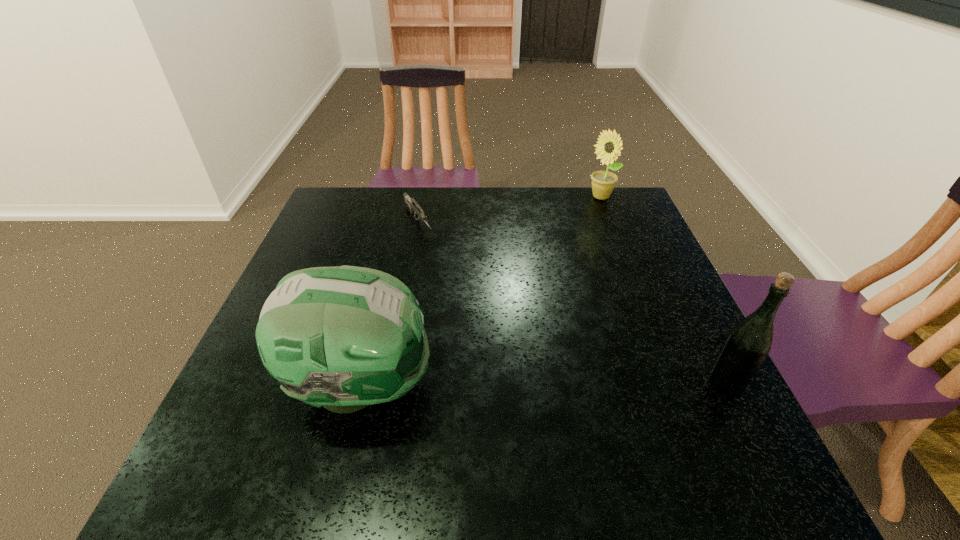
Identify the location of free location that satisfies the following two spatial constraints: 1. on the front side of the third object from left to right; 2. on the right side of the beer bottle. The height and width of the screenshot is (540, 960). (674, 383).